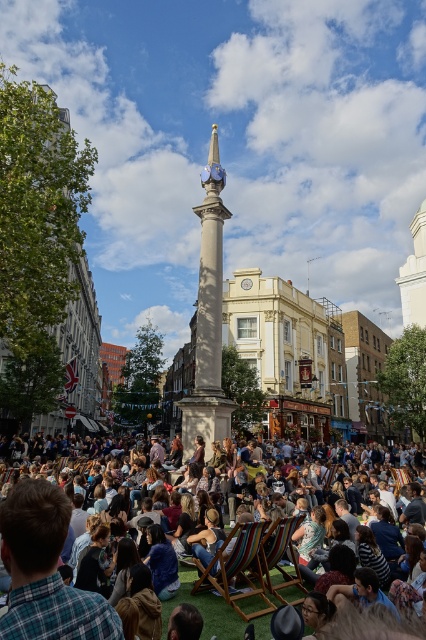
Which is above, smooth stone column at center or multicolored striped deck chairs at center?

smooth stone column at center

Does point (209, 376) lie in front of point (68, 541)?

That is False.

This screenshot has width=426, height=640. In order to click on smooth stone column at center in this screenshot , I will do `click(209, 316)`.

Based on the photo, does plaid shirt at lower left appear over smooth stone column at center?

No, plaid shirt at lower left is not above smooth stone column at center.

Does plaid shirt at lower left have a greater width compared to smooth stone column at center?

No, plaid shirt at lower left is not wider than smooth stone column at center.

Is point (54, 608) in front of point (204, 397)?

Yes, point (54, 608) is in front of point (204, 397).

This screenshot has height=640, width=426. I want to click on plaid shirt at lower left, so click(x=46, y=572).

Who is more distant from viewer, (203,563) or (285,532)?

The point (203,563) is more distant.

Is multicolored wood deck chair at center positioned in front of multicolored fabric deck chair at center?

Yes.

What do you see at coordinates (238, 566) in the screenshot? I see `multicolored wood deck chair at center` at bounding box center [238, 566].

Find the location of a particular element. This screenshot has width=426, height=640. multicolored wood deck chair at center is located at coordinates (238, 566).